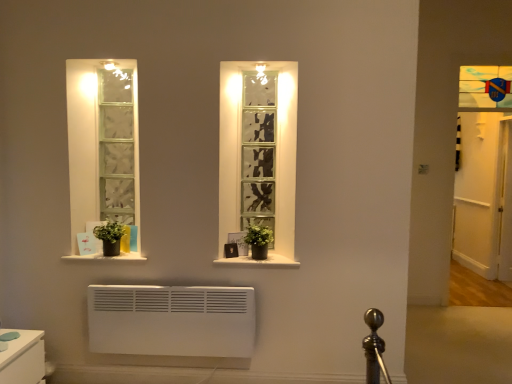
Identify the location of black matte window sill at center, arranged as the second window sill when viewed from the left. (260, 261).

Image resolution: width=512 pixels, height=384 pixels. What do you see at coordinates (484, 196) in the screenshot? I see `white glossy door at right` at bounding box center [484, 196].

I want to click on green matte plant at center, marked as the 2th plant in a left-to-right arrangement, so click(x=258, y=234).

Identify the location of white wooden door at right. (506, 205).

This screenshot has width=512, height=384. I want to click on black matte window sill at center, arranged as the second window sill when viewed from the left, so click(260, 261).

Which of these two, white wooden door at right or green matte plant at lower left, which ranks as the first plant in left-to-right order, is smaller?

green matte plant at lower left, which ranks as the first plant in left-to-right order, is smaller.

Which of these two, white wooden door at right or green matte plant at lower left, which ranks as the first plant in left-to-right order, is wider?

green matte plant at lower left, which ranks as the first plant in left-to-right order, is wider.

Is white wooden door at right turned away from green matte plant at lower left, which ranks as the first plant in left-to-right order?

white wooden door at right is not turned away from green matte plant at lower left, which ranks as the first plant in left-to-right order.

From the image's perspective, is white wooden door at right above or below green matte plant at lower left, which ranks as the first plant in left-to-right order?

white wooden door at right is situated higher than green matte plant at lower left, which ranks as the first plant in left-to-right order, in the image.

Measure the distance between white matte window sill at lower left, which ranks as the 2th window sill in right-to-left order, and black matte window sill at center, the 1th window sill when ordered from right to left.

white matte window sill at lower left, which ranks as the 2th window sill in right-to-left order, is 28.48 inches away from black matte window sill at center, the 1th window sill when ordered from right to left.

Can you confirm if white matte window sill at lower left, which is the first window sill in left-to-right order, is wider than black matte window sill at center, arranged as the second window sill when viewed from the left?

Indeed, white matte window sill at lower left, which is the first window sill in left-to-right order, has a greater width compared to black matte window sill at center, arranged as the second window sill when viewed from the left.

Can you confirm if white matte window sill at lower left, which ranks as the 2th window sill in right-to-left order, is taller than black matte window sill at center, the 1th window sill when ordered from right to left?

Indeed, white matte window sill at lower left, which ranks as the 2th window sill in right-to-left order, has a greater height compared to black matte window sill at center, the 1th window sill when ordered from right to left.

Who is more distant, white matte window sill at lower left, which is the first window sill in left-to-right order, or black matte window sill at center, the 1th window sill when ordered from right to left?

white matte window sill at lower left, which is the first window sill in left-to-right order, is further away from the camera.

Is white glossy door at right shorter than white matte window sill at lower left, which ranks as the 2th window sill in right-to-left order?

No, white glossy door at right is not shorter than white matte window sill at lower left, which ranks as the 2th window sill in right-to-left order.

From the image's perspective, is white glossy door at right beneath white matte window sill at lower left, which ranks as the 2th window sill in right-to-left order?

Incorrect, from the image's perspective, white glossy door at right is higher than white matte window sill at lower left, which ranks as the 2th window sill in right-to-left order.

Is white glossy door at right closer to the viewer compared to white matte window sill at lower left, which ranks as the 2th window sill in right-to-left order?

No, the depth of white glossy door at right is greater than that of white matte window sill at lower left, which ranks as the 2th window sill in right-to-left order.

Considering the relative sizes of white glossy door at right and white matte window sill at lower left, which is the first window sill in left-to-right order, in the image provided, is white glossy door at right thinner than white matte window sill at lower left, which is the first window sill in left-to-right order,?

Yes, white glossy door at right is thinner than white matte window sill at lower left, which is the first window sill in left-to-right order.

Based on their sizes in the image, would you say white glossy door at right is bigger or smaller than green matte plant at center, the 1th plant positioned from the right?

Clearly, white glossy door at right is larger in size than green matte plant at center, the 1th plant positioned from the right.

Is white glossy door at right situated inside green matte plant at center, marked as the 2th plant in a left-to-right arrangement, or outside?

The correct answer is: outside.

Who is more distant, white glossy door at right or green matte plant at center, marked as the 2th plant in a left-to-right arrangement?

white glossy door at right is further away from the camera.

From the image's perspective, which one is positioned higher, white glossy door at right or green matte plant at center, the 1th plant positioned from the right?

white glossy door at right is shown above in the image.

The height and width of the screenshot is (384, 512). In order to click on plant that is the 1st object to the left of the black matte window sill at center, the 1th window sill when ordered from right to left, starting at the anchor in this screenshot , I will do `click(258, 234)`.

Considering the relative positions of green matte plant at center, the 1th plant positioned from the right, and black matte window sill at center, arranged as the second window sill when viewed from the left, in the image provided, is green matte plant at center, the 1th plant positioned from the right, to the right of black matte window sill at center, arranged as the second window sill when viewed from the left, from the viewer's perspective?

No, green matte plant at center, the 1th plant positioned from the right, is not to the right of black matte window sill at center, arranged as the second window sill when viewed from the left.

What's the angular difference between green matte plant at center, the 1th plant positioned from the right, and black matte window sill at center, arranged as the second window sill when viewed from the left,'s facing directions?

The facing directions of green matte plant at center, the 1th plant positioned from the right, and black matte window sill at center, arranged as the second window sill when viewed from the left, are 0.867 degrees apart.

Which is behind, green matte plant at center, marked as the 2th plant in a left-to-right arrangement, or black matte window sill at center, arranged as the second window sill when viewed from the left?

black matte window sill at center, arranged as the second window sill when viewed from the left, is further from the camera.

There is a white wooden door at right. In order to click on the 2nd plant below it (from the image's perspective) in this screenshot , I will do (258, 234).

Is point (270, 228) positioned behind point (511, 197)?

No, it is in front of (511, 197).

How different are the orientations of green matte plant at center, the 1th plant positioned from the right, and white wooden door at right in degrees?

The angular difference between green matte plant at center, the 1th plant positioned from the right, and white wooden door at right is 4.78 degrees.

Is green matte plant at center, the 1th plant positioned from the right, closer to camera compared to white wooden door at right?

Yes, it is.

Does white wooden door at right lie in front of white glossy door at right?

No, it is behind white glossy door at right.

Does white wooden door at right have a greater width compared to white glossy door at right?

Correct, the width of white wooden door at right exceeds that of white glossy door at right.

What's the angular difference between white wooden door at right and white glossy door at right's facing directions?

The facing directions of white wooden door at right and white glossy door at right are 6.22 degrees apart.

Between white wooden door at right and white glossy door at right, which one has smaller size?

white wooden door at right.

You are a GUI agent. You are given a task and a screenshot of the screen. Output one action in this format:
    pyautogui.click(x=<x>, y=<y>)
    Task: Click on the 2nd plant counting from the left side of the white wooden door at right
    
    Given the screenshot: What is the action you would take?
    pyautogui.click(x=111, y=232)

This screenshot has width=512, height=384. Find the location of `window sill that is in front of the white matte window sill at lower left, which is the first window sill in left-to-right order`. window sill that is in front of the white matte window sill at lower left, which is the first window sill in left-to-right order is located at coordinates (260, 261).

Estimate the real-world distances between objects in this image. Which object is further from green matte plant at lower left, which ranks as the first plant in left-to-right order, black matte window sill at center, arranged as the second window sill when viewed from the left, or white wooden door at right?

white wooden door at right is positioned further to the anchor green matte plant at lower left, which ranks as the first plant in left-to-right order.

Considering their positions, is green matte plant at center, marked as the 2th plant in a left-to-right arrangement, positioned closer to white glossy door at right than white wooden door at right?

white wooden door at right.

When comparing their distances from green matte plant at center, the 1th plant positioned from the right, does white wooden door at right or white matte window sill at lower left, which ranks as the 2th window sill in right-to-left order, seem closer?

white matte window sill at lower left, which ranks as the 2th window sill in right-to-left order.

From the image, which object appears to be nearer to white wooden door at right, white glossy door at right or green matte plant at lower left, which ranks as the first plant in left-to-right order?

Based on the image, white glossy door at right appears to be nearer to white wooden door at right.

From the image, which object appears to be farther from black matte window sill at center, the 1th window sill when ordered from right to left, green matte plant at center, marked as the 2th plant in a left-to-right arrangement, or green matte plant at lower left, positioned as the 2th plant in right-to-left order?

green matte plant at lower left, positioned as the 2th plant in right-to-left order.

When comparing their distances from black matte window sill at center, the 1th window sill when ordered from right to left, does white glossy door at right or white matte window sill at lower left, which is the first window sill in left-to-right order, seem further?

The object further to black matte window sill at center, the 1th window sill when ordered from right to left, is white glossy door at right.

Looking at the image, which one is located further to green matte plant at lower left, which ranks as the first plant in left-to-right order, black matte window sill at center, the 1th window sill when ordered from right to left, or green matte plant at center, the 1th plant positioned from the right?

Among the two, green matte plant at center, the 1th plant positioned from the right, is located further to green matte plant at lower left, which ranks as the first plant in left-to-right order.

From the image, which object appears to be farther from green matte plant at lower left, which ranks as the first plant in left-to-right order, green matte plant at center, marked as the 2th plant in a left-to-right arrangement, or black matte window sill at center, arranged as the second window sill when viewed from the left?

green matte plant at center, marked as the 2th plant in a left-to-right arrangement, lies further to green matte plant at lower left, which ranks as the first plant in left-to-right order, than the other object.

Where is `plant located between green matte plant at lower left, which ranks as the first plant in left-to-right order, and white glossy door at right in the left-right direction`? plant located between green matte plant at lower left, which ranks as the first plant in left-to-right order, and white glossy door at right in the left-right direction is located at coordinates (258, 234).

The image size is (512, 384). What are the coordinates of `plant between white matte window sill at lower left, which is the first window sill in left-to-right order, and green matte plant at center, marked as the 2th plant in a left-to-right arrangement, in the horizontal direction` in the screenshot? It's located at (111, 232).

You are a GUI agent. You are given a task and a screenshot of the screen. Output one action in this format:
    pyautogui.click(x=<x>, y=<y>)
    Task: Click on the window sill between white matte window sill at lower left, which is the first window sill in left-to-right order, and white glossy door at right
    
    Given the screenshot: What is the action you would take?
    pyautogui.click(x=260, y=261)

You are a GUI agent. You are given a task and a screenshot of the screen. Output one action in this format:
    pyautogui.click(x=<x>, y=<y>)
    Task: Click on the window sill between green matte plant at center, marked as the 2th plant in a left-to-right arrangement, and white glossy door at right from left to right
    The width and height of the screenshot is (512, 384).
    Given the screenshot: What is the action you would take?
    pyautogui.click(x=260, y=261)